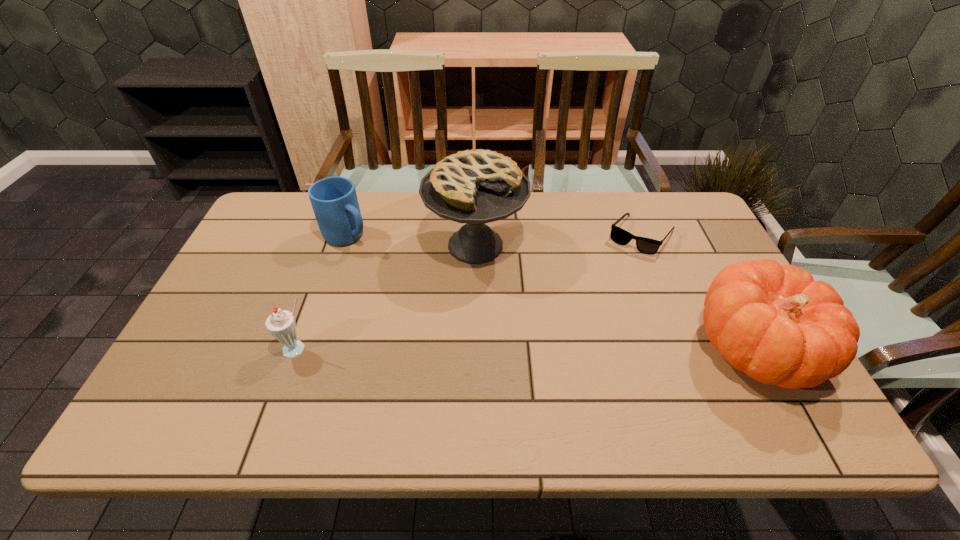
The width and height of the screenshot is (960, 540). In order to click on object that stands as the closest to the shortest object in this screenshot , I will do `click(773, 322)`.

Where is `vacant area that satisfies the following two spatial constraints: 1. on the front side of the fourth shortest object; 2. on the right side of the sunglasses`? Image resolution: width=960 pixels, height=540 pixels. vacant area that satisfies the following two spatial constraints: 1. on the front side of the fourth shortest object; 2. on the right side of the sunglasses is located at coordinates (687, 349).

Where is `vacant area in the image that satisfies the following two spatial constraints: 1. on the straw side of the fourth shortest object; 2. on the right side of the milkshake`? The width and height of the screenshot is (960, 540). vacant area in the image that satisfies the following two spatial constraints: 1. on the straw side of the fourth shortest object; 2. on the right side of the milkshake is located at coordinates (298, 349).

Where is `blank area in the image that satisfies the following two spatial constraints: 1. on the straw side of the second tallest object; 2. on the left side of the milkshake`? Image resolution: width=960 pixels, height=540 pixels. blank area in the image that satisfies the following two spatial constraints: 1. on the straw side of the second tallest object; 2. on the left side of the milkshake is located at coordinates (298, 349).

You are a GUI agent. You are given a task and a screenshot of the screen. Output one action in this format:
    pyautogui.click(x=<x>, y=<y>)
    Task: Click on the free space that satisfies the following two spatial constraints: 1. on the straw side of the second tallest object; 2. on the right side of the milkshake
    The width and height of the screenshot is (960, 540).
    Given the screenshot: What is the action you would take?
    pyautogui.click(x=298, y=349)

Find the location of a particular element. This screenshot has height=540, width=960. free point that satisfies the following two spatial constraints: 1. on the back side of the sunglasses; 2. on the right side of the tallest object is located at coordinates (475, 235).

This screenshot has width=960, height=540. What are the coordinates of `free space that satisfies the following two spatial constraints: 1. on the back side of the mug; 2. on the right side of the sunglasses` in the screenshot? It's located at (348, 235).

Locate an element on the screen. The height and width of the screenshot is (540, 960). vacant space that satisfies the following two spatial constraints: 1. on the back side of the shortest object; 2. on the right side of the tallest object is located at coordinates (475, 235).